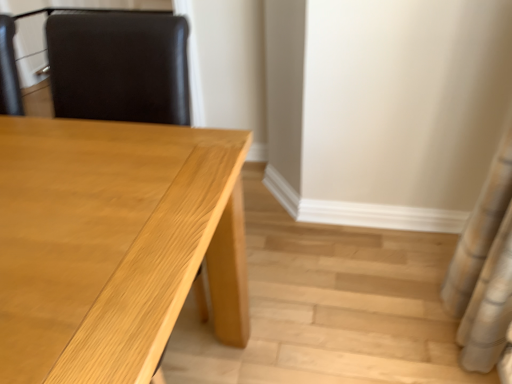
Question: Is white textured shower curtain at right bigger or smaller than light wood table at center?

Choices:
 (A) small
 (B) big

Answer: (A)

Question: Based on their positions, is white textured shower curtain at right located to the left or right of light wood table at center?

Choices:
 (A) left
 (B) right

Answer: (B)

Question: From a real-world perspective, is white textured shower curtain at right positioned above or below light wood table at center?

Choices:
 (A) below
 (B) above

Answer: (B)

Question: Considering their positions, is light wood table at center located in front of or behind white textured shower curtain at right?

Choices:
 (A) front
 (B) behind

Answer: (A)

Question: Considering the positions of light wood table at center and white textured shower curtain at right in the image, is light wood table at center taller or shorter than white textured shower curtain at right?

Choices:
 (A) short
 (B) tall

Answer: (A)

Question: Would you say light wood table at center is to the left or to the right of white textured shower curtain at right in the picture?

Choices:
 (A) left
 (B) right

Answer: (A)

Question: Which is correct: light wood table at center is inside white textured shower curtain at right, or outside of it?

Choices:
 (A) outside
 (B) inside

Answer: (A)